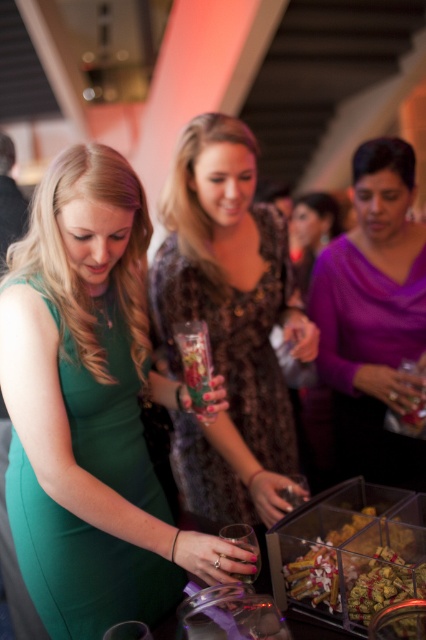
This screenshot has height=640, width=426. Find the location of `translucent plastic tray at lower right`. translucent plastic tray at lower right is located at coordinates (354, 561).

Which is above, translucent plastic tray at lower right or translucent glass vase at center?

translucent glass vase at center is higher up.

Where is `translucent plastic tray at lower right`? translucent plastic tray at lower right is located at coordinates (354, 561).

Does green satin dress at lower left appear over purple matte sweater at center?

No.

Identify the location of green satin dress at lower left. The image size is (426, 640). (80, 563).

I want to click on green satin dress at lower left, so click(80, 563).

Is purple matte sweater at center shorter than translucent plastic tray at lower right?

Incorrect, purple matte sweater at center's height does not fall short of translucent plastic tray at lower right's.

Can you confirm if purple matte sweater at center is taller than translucent plastic tray at lower right?

Indeed, purple matte sweater at center has a greater height compared to translucent plastic tray at lower right.

Based on the photo, who is more forward, (371, 252) or (287, 593)?

Point (287, 593) is in front.

Locate an element on the screen. This screenshot has width=426, height=640. purple matte sweater at center is located at coordinates (374, 317).